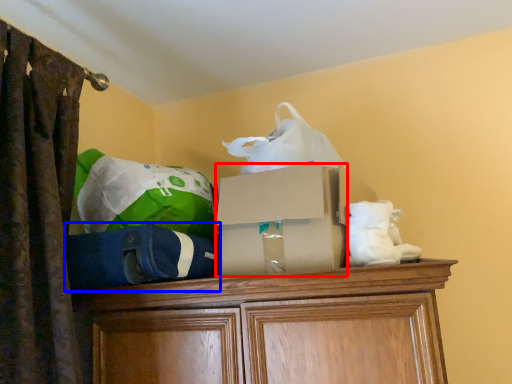
Question: Which of the following is the farthest to the observer, storage box (highlighted by a red box) or bean bag chair (highlighted by a blue box)?

Choices:
 (A) storage box
 (B) bean bag chair

Answer: (A)